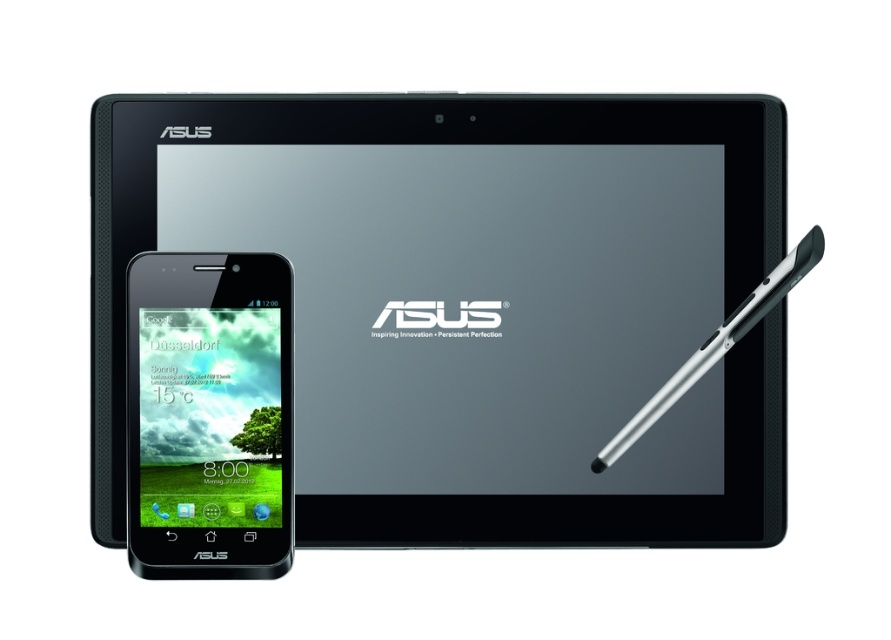
You are a delivery person who needs to place a 4 inch wide package between the black matte tablet at upper center and the black matte smartphone at lower left. Can the package fit in the space between them?

The distance between the black matte tablet at upper center and the black matte smartphone at lower left is 3.95 inches. Since the package is 4 inches wide, it cannot fit in the space between them.

You are designing a promotional stand and need to place the black matte smartphone at lower left and the silver metallic stylus at right on a shelf. The shelf has a height limit of 10 cm. Can both items fit vertically without exceeding the height limit?

The black matte smartphone at lower left is taller than the silver metallic stylus at right. Since the shelf has a height limit of 10 cm, we need to know the exact height of the smartphone to determine if it fits. However, the description only states their relative sizes. Without specific measurements, we cannot confirm if both will fit within the 10 cm limit.